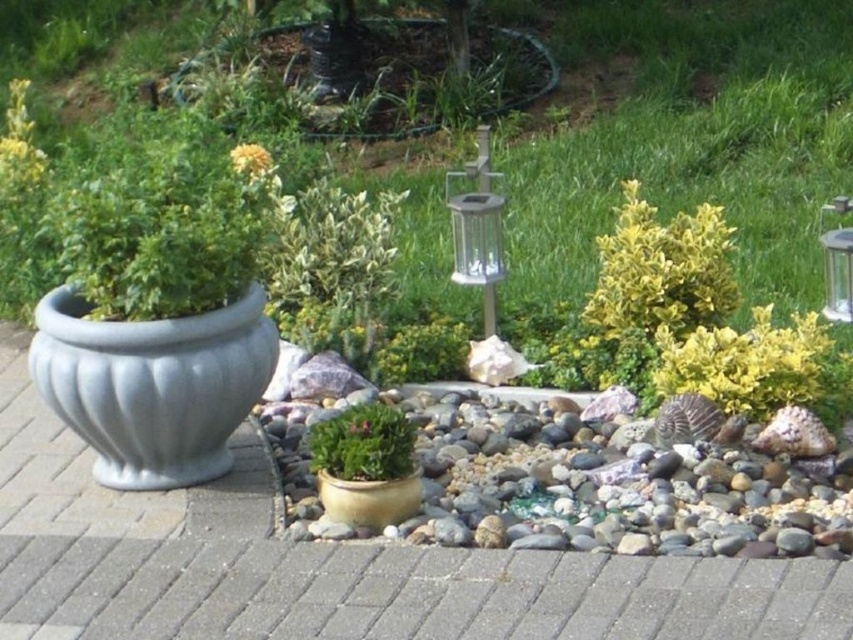
You are designing a garden layout and need to place a new statue that requires a base at least 20 cm tall. You have the matte gold pot at center and the green leafy plant at upper left. Which object can serve as a stable base for the statue?

The green leafy plant at upper left is taller than the matte gold pot at center. Since the statue requires a base at least 20 cm tall, the green leafy plant at upper left would be the better option as its height meets the requirement, assuming it is tall enough. However, the matte gold pot at center is shorter, so it might not provide sufficient height. Please verify the exact height of the green leafy plant at upper left before deciding.